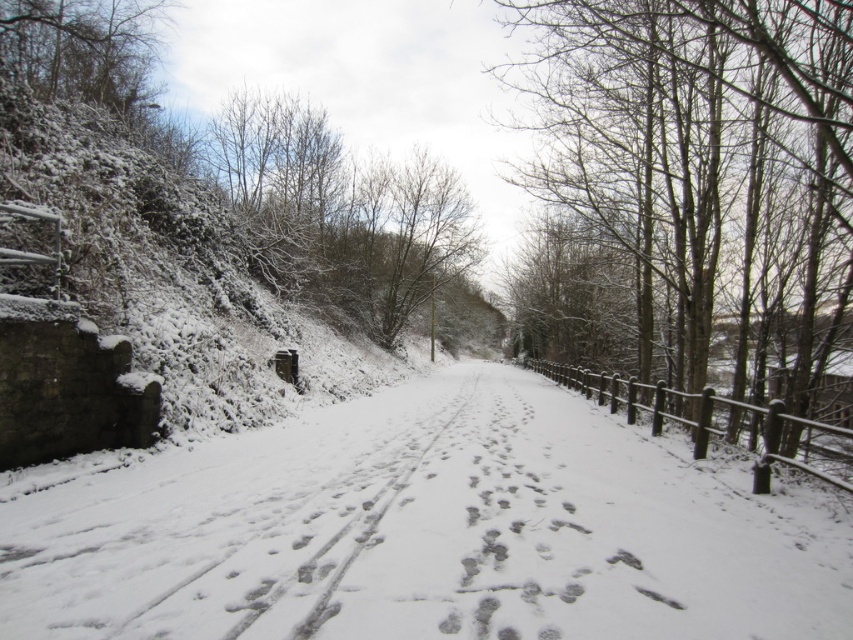
Consider the image. You are standing at the starting point of the road and want to walk towards the distant end. Where is the white powdery snow at center located relative to your path?

The white powdery snow at center is located at the center of the road, directly in front of your path as you walk towards the distant end.